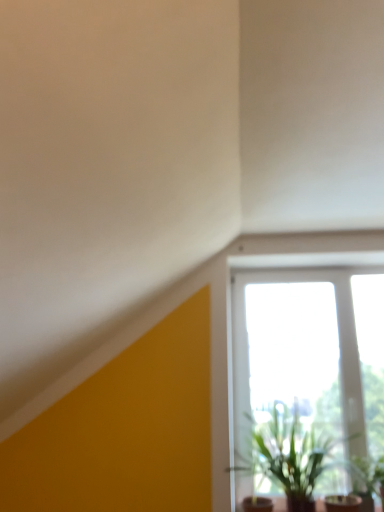
The image size is (384, 512). I want to click on transparent glass window at center, so click(309, 352).

Measure the distance between green leafy plant at lower right, marked as the second houseplant in a right-to-left arrangement, and camera.

green leafy plant at lower right, marked as the second houseplant in a right-to-left arrangement, is 2.17 meters from camera.

Find the location of `transparent glass window at center`. transparent glass window at center is located at coordinates (309, 352).

Between green leafy plant at lower right, marked as the second houseplant in a right-to-left arrangement, and transparent glass window at center, which one has larger width?

Wider between the two is green leafy plant at lower right, marked as the second houseplant in a right-to-left arrangement.

From the image's perspective, is green leafy plant at lower right, marked as the second houseplant in a right-to-left arrangement, located beneath transparent glass window at center?

Yes.

Is green leafy plant at lower right, marked as the second houseplant in a right-to-left arrangement, to the left of transparent glass window at center from the viewer's perspective?

Yes.

Which object is closer to the camera taking this photo, green leafy plant at lower right, the 1th houseplant from the left, or transparent glass window at center?

green leafy plant at lower right, the 1th houseplant from the left, is in front.

Which object is more forward, green leafy plant at lower right, the 2th houseplant from the left, or green leafy plant at lower right, marked as the second houseplant in a right-to-left arrangement?

Positioned in front is green leafy plant at lower right, marked as the second houseplant in a right-to-left arrangement.

In order to click on houseplant that appears below the green leafy plant at lower right, the 1th houseplant from the left (from the image's perspective) in this screenshot , I will do `click(366, 479)`.

Based on their sizes in the image, would you say green leafy plant at lower right, which is the first houseplant from right to left, is bigger or smaller than green leafy plant at lower right, the 1th houseplant from the left?

Considering their sizes, green leafy plant at lower right, which is the first houseplant from right to left, takes up less space than green leafy plant at lower right, the 1th houseplant from the left.

Which is more to the right, green leafy plant at lower right, which is the first houseplant from right to left, or transparent glass window at center?

From the viewer's perspective, green leafy plant at lower right, which is the first houseplant from right to left, appears more on the right side.

Could you tell me if green leafy plant at lower right, the 2th houseplant from the left, is facing transparent glass window at center?

No, green leafy plant at lower right, the 2th houseplant from the left, is not facing towards transparent glass window at center.

Can you tell me how much green leafy plant at lower right, the 2th houseplant from the left, and transparent glass window at center differ in facing direction?

The facing directions of green leafy plant at lower right, the 2th houseplant from the left, and transparent glass window at center are 5.71 degrees apart.

From the picture: Is the surface of green leafy plant at lower right, the 2th houseplant from the left, in direct contact with transparent glass window at center?

green leafy plant at lower right, the 2th houseplant from the left, is not next to transparent glass window at center, and they're not touching.

Which object is closer to the camera, transparent glass window at center or green leafy plant at lower right, which is the first houseplant from right to left?

green leafy plant at lower right, which is the first houseplant from right to left, is closer to the camera.

What's the angular difference between transparent glass window at center and green leafy plant at lower right, the 2th houseplant from the left,'s facing directions?

The facing directions of transparent glass window at center and green leafy plant at lower right, the 2th houseplant from the left, are 5.71 degrees apart.

Could you tell me if transparent glass window at center is facing green leafy plant at lower right, the 2th houseplant from the left?

Yes, transparent glass window at center is facing green leafy plant at lower right, the 2th houseplant from the left.

Can you confirm if transparent glass window at center is taller than green leafy plant at lower right, which is the first houseplant from right to left?

Indeed, transparent glass window at center has a greater height compared to green leafy plant at lower right, which is the first houseplant from right to left.

From a real-world perspective, does transparent glass window at center stand above green leafy plant at lower right, the 1th houseplant from the left?

Yes, from a real-world perspective, transparent glass window at center is above green leafy plant at lower right, the 1th houseplant from the left.

Is point (261, 403) more distant than point (272, 426)?

Yes, it is behind point (272, 426).

The image size is (384, 512). What are the coordinates of `window behind the green leafy plant at lower right, the 1th houseplant from the left` in the screenshot? It's located at coord(309,352).

In terms of width, does transparent glass window at center look wider or thinner when compared to green leafy plant at lower right, the 1th houseplant from the left?

In the image, transparent glass window at center appears to be more narrow than green leafy plant at lower right, the 1th houseplant from the left.

Between green leafy plant at lower right, the 1th houseplant from the left, and green leafy plant at lower right, which is the first houseplant from right to left, which one appears on the right side from the viewer's perspective?

From the viewer's perspective, green leafy plant at lower right, which is the first houseplant from right to left, appears more on the right side.

Can you tell me how much green leafy plant at lower right, marked as the second houseplant in a right-to-left arrangement, and green leafy plant at lower right, the 2th houseplant from the left, differ in facing direction?

There is a 7.27-degree angle between the facing directions of green leafy plant at lower right, marked as the second houseplant in a right-to-left arrangement, and green leafy plant at lower right, the 2th houseplant from the left.

Looking at this image, looking at the image, does green leafy plant at lower right, marked as the second houseplant in a right-to-left arrangement, seem bigger or smaller compared to green leafy plant at lower right, which is the first houseplant from right to left?

In the image, green leafy plant at lower right, marked as the second houseplant in a right-to-left arrangement, appears to be larger than green leafy plant at lower right, which is the first houseplant from right to left.

From the image's perspective, which object appears higher, green leafy plant at lower right, the 1th houseplant from the left, or green leafy plant at lower right, which is the first houseplant from right to left?

Result: green leafy plant at lower right, the 1th houseplant from the left, is shown above in the image.

There is a transparent glass window at center. At what (x,y) coordinates should I click in order to perform the action: click on the 1st houseplant below it (from a real-world perspective). Please return your answer as a coordinate pair (x, y). The image size is (384, 512). Looking at the image, I should click on (289, 456).

The height and width of the screenshot is (512, 384). Identify the location of houseplant on the right of the green leafy plant at lower right, marked as the second houseplant in a right-to-left arrangement. (366, 479).

Looking at the image, which one is located further to green leafy plant at lower right, which is the first houseplant from right to left, transparent glass window at center or green leafy plant at lower right, the 1th houseplant from the left?

The object further to green leafy plant at lower right, which is the first houseplant from right to left, is transparent glass window at center.

Estimate the real-world distances between objects in this image. Which object is closer to transparent glass window at center, green leafy plant at lower right, which is the first houseplant from right to left, or green leafy plant at lower right, marked as the second houseplant in a right-to-left arrangement?

green leafy plant at lower right, marked as the second houseplant in a right-to-left arrangement, is positioned closer to the anchor transparent glass window at center.

Looking at the image, which one is located further to green leafy plant at lower right, the 1th houseplant from the left, transparent glass window at center or green leafy plant at lower right, the 2th houseplant from the left?

Among the two, green leafy plant at lower right, the 2th houseplant from the left, is located further to green leafy plant at lower right, the 1th houseplant from the left.

Based on their spatial positions, is green leafy plant at lower right, which is the first houseplant from right to left, or transparent glass window at center further from green leafy plant at lower right, the 1th houseplant from the left?

Among the two, green leafy plant at lower right, which is the first houseplant from right to left, is located further to green leafy plant at lower right, the 1th houseplant from the left.

Looking at the image, which one is located closer to green leafy plant at lower right, which is the first houseplant from right to left, green leafy plant at lower right, marked as the second houseplant in a right-to-left arrangement, or transparent glass window at center?

green leafy plant at lower right, marked as the second houseplant in a right-to-left arrangement, lies closer to green leafy plant at lower right, which is the first houseplant from right to left, than the other object.

Looking at the image, which one is located closer to transparent glass window at center, green leafy plant at lower right, marked as the second houseplant in a right-to-left arrangement, or green leafy plant at lower right, the 2th houseplant from the left?

The object closer to transparent glass window at center is green leafy plant at lower right, marked as the second houseplant in a right-to-left arrangement.

You are a GUI agent. You are given a task and a screenshot of the screen. Output one action in this format:
    pyautogui.click(x=<x>, y=<y>)
    Task: Click on the houseplant between green leafy plant at lower right, the 1th houseplant from the left, and transparent glass window at center, along the z-axis
    
    Given the screenshot: What is the action you would take?
    pyautogui.click(x=366, y=479)